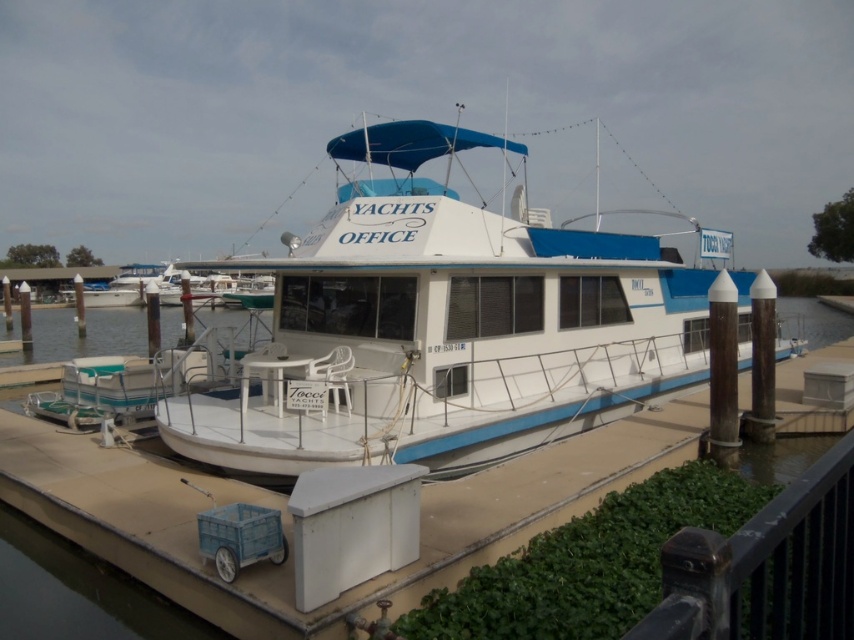
Does white matte boat at center have a larger size compared to black metal/rail at lower right?

Correct, white matte boat at center is larger in size than black metal/rail at lower right.

Is white matte boat at center to the left of black metal/rail at lower right from the viewer's perspective?

Indeed, white matte boat at center is positioned on the left side of black metal/rail at lower right.

Between point (398, 342) and point (826, 561), which one is positioned behind?

Point (398, 342)

Find the location of a particular element. Image resolution: width=854 pixels, height=640 pixels. white matte boat at center is located at coordinates (443, 326).